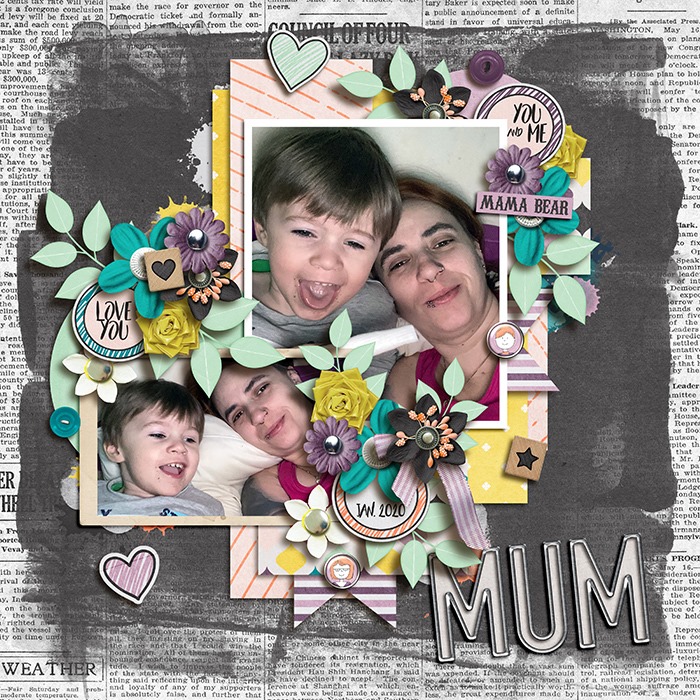
At what (x,y) coordinates should I click in order to perform the action: click on photographs. Please return your answer as a coordinate pair (x, y). This screenshot has width=700, height=700. Looking at the image, I should click on (171, 435), (264, 409), (306, 216), (433, 266).